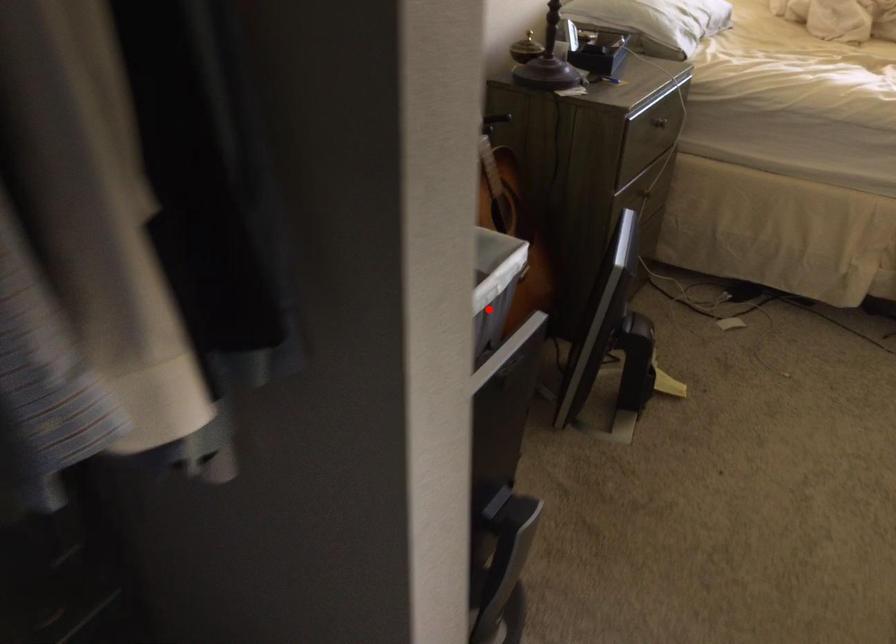
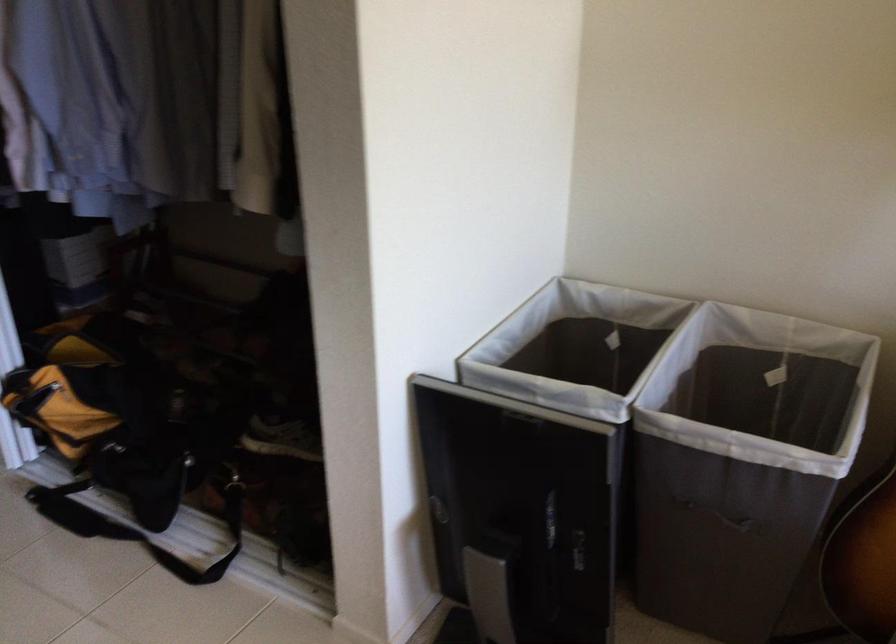
Question: I am providing you with two images of the same scene from different viewpoints. In image1, a red point is highlighted. Considering the same 3D point in image2, which of the following is correct?

Choices:
 (A) It is closer
 (B) It is farther

Answer: (A)